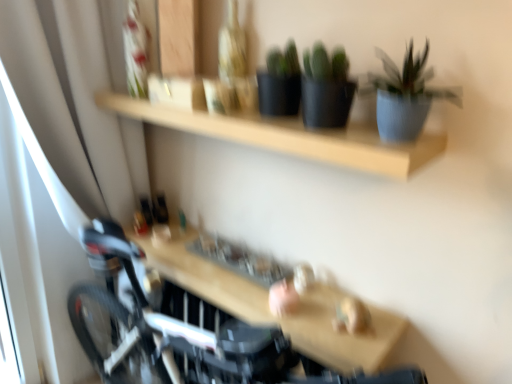
Question: Is blue matte pot at upper right thinner than wooden shelf at center?

Choices:
 (A) no
 (B) yes

Answer: (B)

Question: Considering the relative sizes of blue matte pot at upper right and wooden shelf at center in the image provided, is blue matte pot at upper right taller than wooden shelf at center?

Choices:
 (A) yes
 (B) no

Answer: (A)

Question: Considering the relative sizes of blue matte pot at upper right and wooden shelf at center in the image provided, is blue matte pot at upper right smaller than wooden shelf at center?

Choices:
 (A) no
 (B) yes

Answer: (B)

Question: Is blue matte pot at upper right far away from wooden shelf at center?

Choices:
 (A) yes
 (B) no

Answer: (B)

Question: Is blue matte pot at upper right positioned with its back to wooden shelf at center?

Choices:
 (A) no
 (B) yes

Answer: (A)

Question: Can you confirm if blue matte pot at upper right is positioned to the left of wooden shelf at center?

Choices:
 (A) yes
 (B) no

Answer: (B)

Question: Is wooden shelf at center shorter than blue matte pot at upper right?

Choices:
 (A) yes
 (B) no

Answer: (A)

Question: Does wooden shelf at center have a greater width compared to blue matte pot at upper right?

Choices:
 (A) yes
 (B) no

Answer: (A)

Question: Does wooden shelf at center have a larger size compared to blue matte pot at upper right?

Choices:
 (A) no
 (B) yes

Answer: (B)

Question: Can you confirm if wooden shelf at center is smaller than blue matte pot at upper right?

Choices:
 (A) no
 (B) yes

Answer: (A)

Question: Would you say wooden shelf at center is outside blue matte pot at upper right?

Choices:
 (A) no
 (B) yes

Answer: (B)

Question: Is wooden shelf at center at the right side of blue matte pot at upper right?

Choices:
 (A) no
 (B) yes

Answer: (A)

Question: Do you think wooden shelf at center is within blue matte pot at upper right, or outside of it?

Choices:
 (A) outside
 (B) inside

Answer: (A)